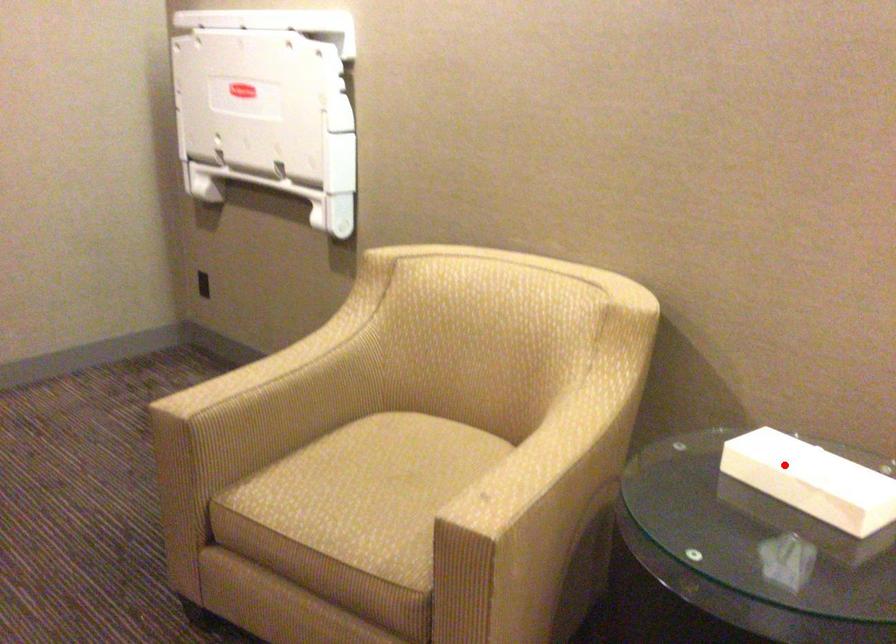
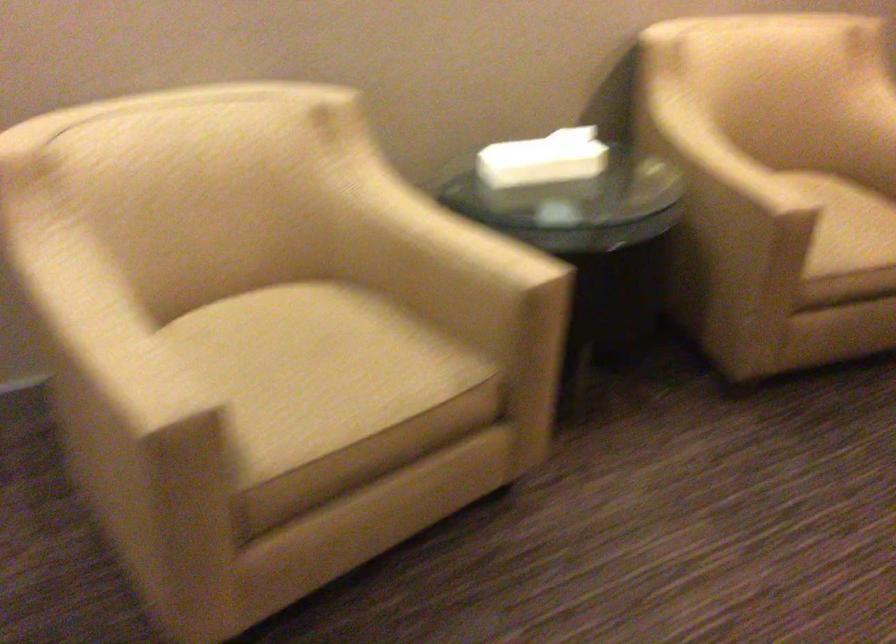
Question: I am providing you with two images of the same scene from different viewpoints. Image1 has a red point marked. In image2, the corresponding 3D location appears at what relative position? Reply with the corresponding letter.

Choices:
 (A) Closer
 (B) Farther

Answer: (B)